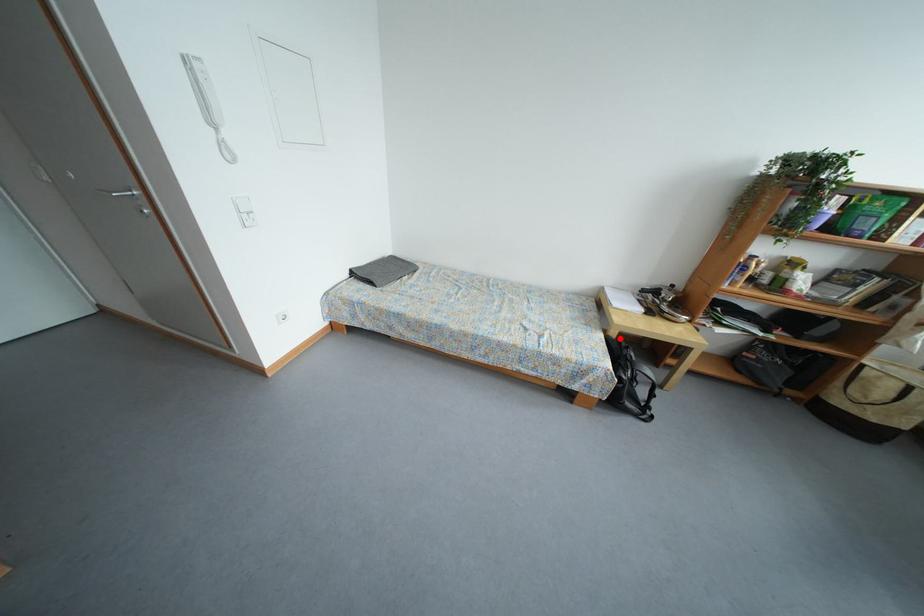
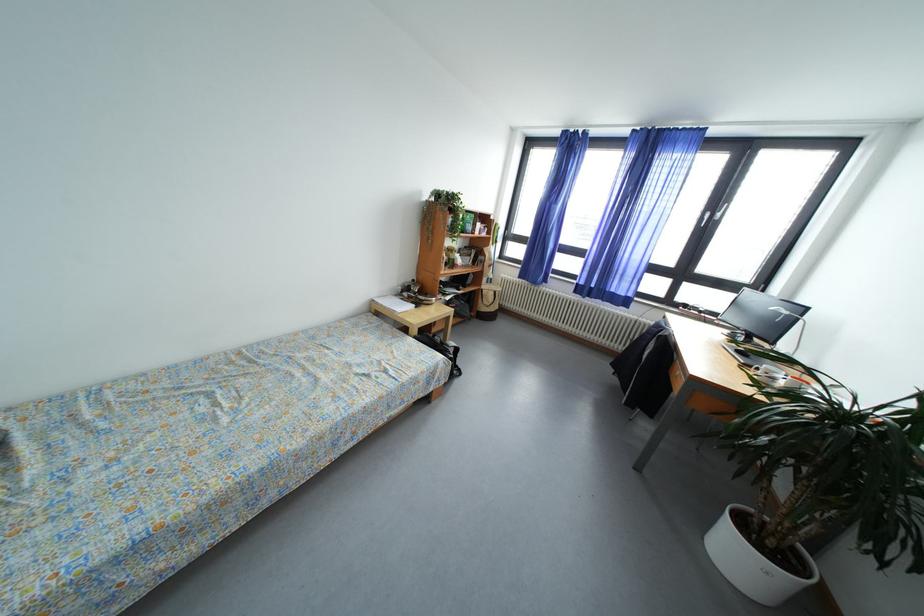
Where in the second image is the point corresponding to the highlighted location from the first image?

(421, 337)